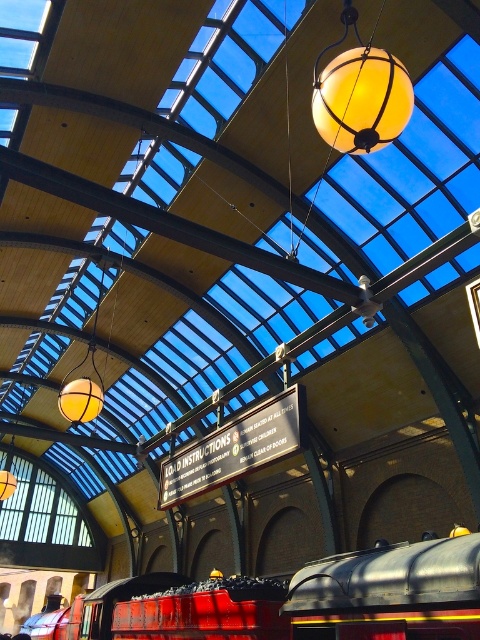
You are a station attendant who needs to guide a visitor to the translucent glass globe at center. The visitor is currently standing near the red glossy train at center. Which direction should they move to reach the globe?

The red glossy train at center is positioned on the left side of the translucent glass globe at center, so the visitor should move to the right to reach the globe.

You are a station attendant and need to determine if the red glossy train at center can pass through a narrow corridor that is only as wide as the translucent glass globe at center. Based on their widths, can the train safely pass through the corridor?

The red glossy train at center is wider than the translucent glass globe at center, so it cannot safely pass through the corridor which is only as wide as the globe.